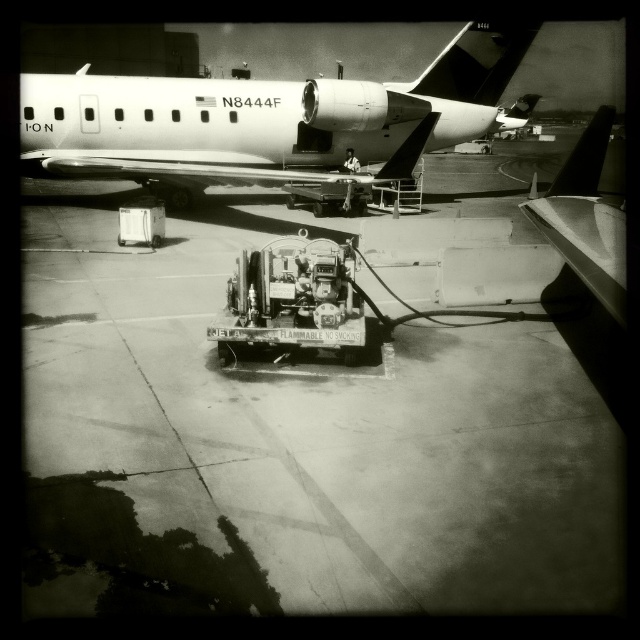
From the picture: Who is shorter, smooth concrete tarmac at center or metallic white airplane at upper left?

Standing shorter between the two is smooth concrete tarmac at center.

Does smooth concrete tarmac at center appear under metallic white airplane at upper left?

Correct, smooth concrete tarmac at center is located below metallic white airplane at upper left.

Between point (452, 412) and point (132, 132), which one is positioned in front?

Point (452, 412)

You are a GUI agent. You are given a task and a screenshot of the screen. Output one action in this format:
    pyautogui.click(x=<x>, y=<y>)
    Task: Click on the smooth concrete tarmac at center
    
    Given the screenshot: What is the action you would take?
    pyautogui.click(x=301, y=440)